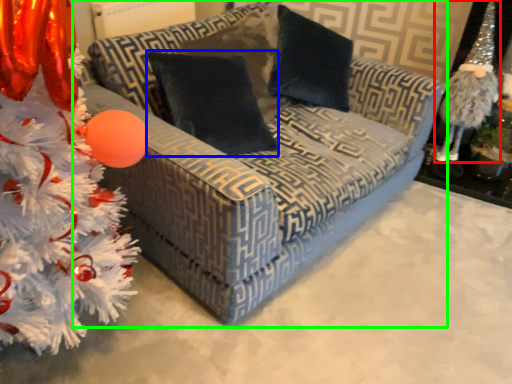
Question: Which object is the closest to the toy (highlighted by a red box)? Choose among these: pillow (highlighted by a blue box) or studio couch (highlighted by a green box).

Choices:
 (A) pillow
 (B) studio couch

Answer: (B)